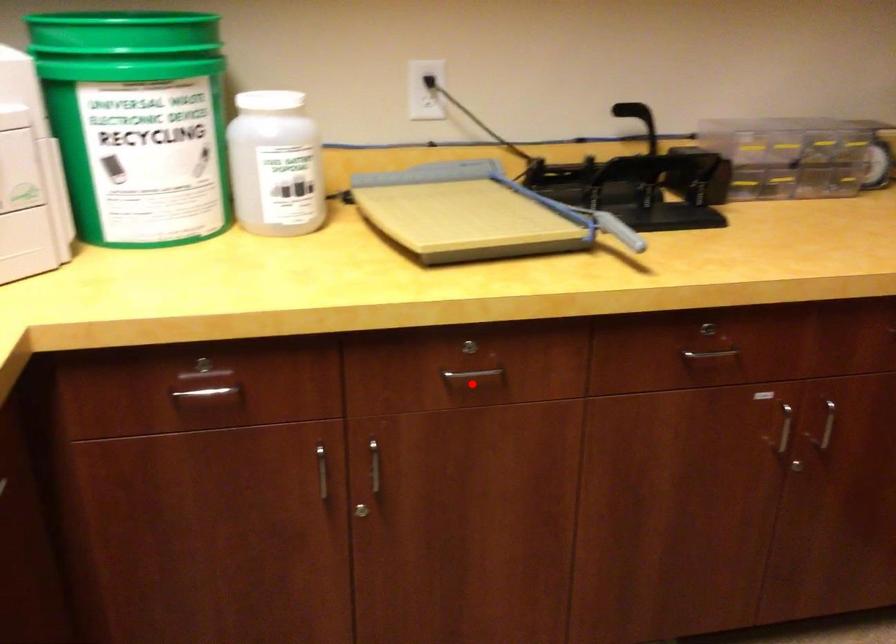
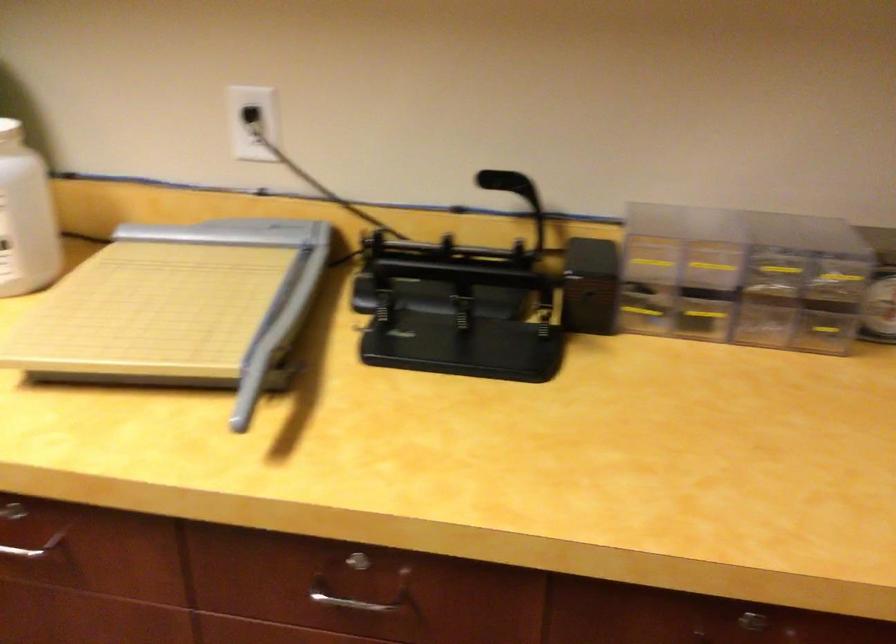
Question: I am providing you with two images of the same scene from different viewpoints. Image1 has a red point marked. In image2, the corresponding 3D location appears at what relative position? Reply with the corresponding letter.

Choices:
 (A) Closer
 (B) Farther

Answer: (A)